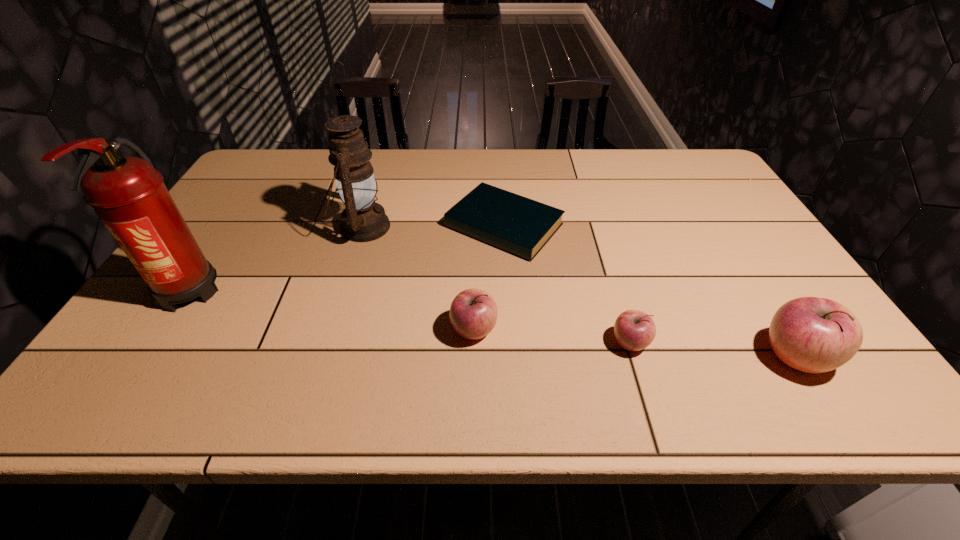
Image resolution: width=960 pixels, height=540 pixels. Find the location of `vacant space at the far edge of the desktop`. vacant space at the far edge of the desktop is located at coordinates (620, 152).

The image size is (960, 540). I want to click on vacant space at the near edge of the desktop, so click(x=218, y=334).

In the image, there is a desktop. Where is `free space at the left edge`? This screenshot has width=960, height=540. free space at the left edge is located at coordinates (228, 215).

The height and width of the screenshot is (540, 960). Find the location of `free space at the right edge of the desktop`. free space at the right edge of the desktop is located at coordinates (715, 202).

I want to click on vacant space at the far left corner, so click(258, 174).

Where is `vacant area that lies between the book and the leftmost object`? vacant area that lies between the book and the leftmost object is located at coordinates (348, 256).

Identify the location of vacant space in between the third shortest object and the second tallest object. pyautogui.click(x=419, y=279).

The width and height of the screenshot is (960, 540). What are the coordinates of `free space between the second object from left to right and the book` in the screenshot? It's located at (434, 226).

This screenshot has height=540, width=960. Identify the location of vacant area between the rightmost apple and the shortest apple. (712, 350).

The width and height of the screenshot is (960, 540). Identify the location of vacant area between the leftmost apple and the shortest apple. (552, 337).